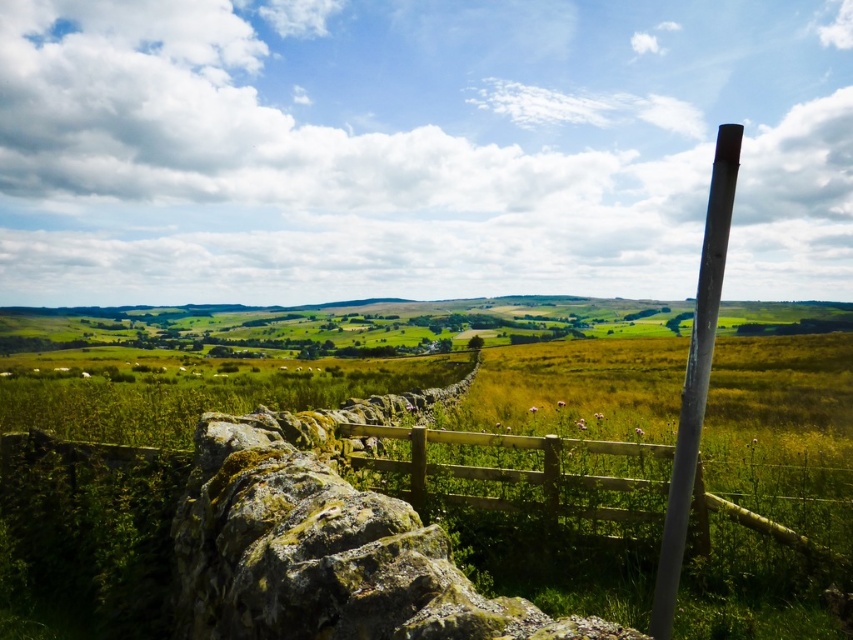
You are standing at the rustic stone wall in the foreground of the scene. You want to place a small garden ornament exactly at the point marked as point (521, 476). Based on the scene description, where should you place it?

The point (521, 476) is on the wooden fence at center, so you should place the ornament on the wooden fence at center.

You are a painter standing in the middle of the rural landscape. You want to paint the wooden fence at center and the white glossy pole at right. Which object should you move closer to in order to capture its full height in your painting?

The wooden fence at center has a lesser height compared to the white glossy pole at right. Therefore, you should move closer to the wooden fence at center to capture its full height since it is shorter and requires less distance to encompass its entire height in the painting.

You are standing at the origin point in the coordinate system of the image. You want to walk towards the wooden fence at center. Which direction should you move in terms of x and y coordinates?

The wooden fence at center is located at coordinates point (521, 476), so you should move in the positive x and positive y direction to reach it.